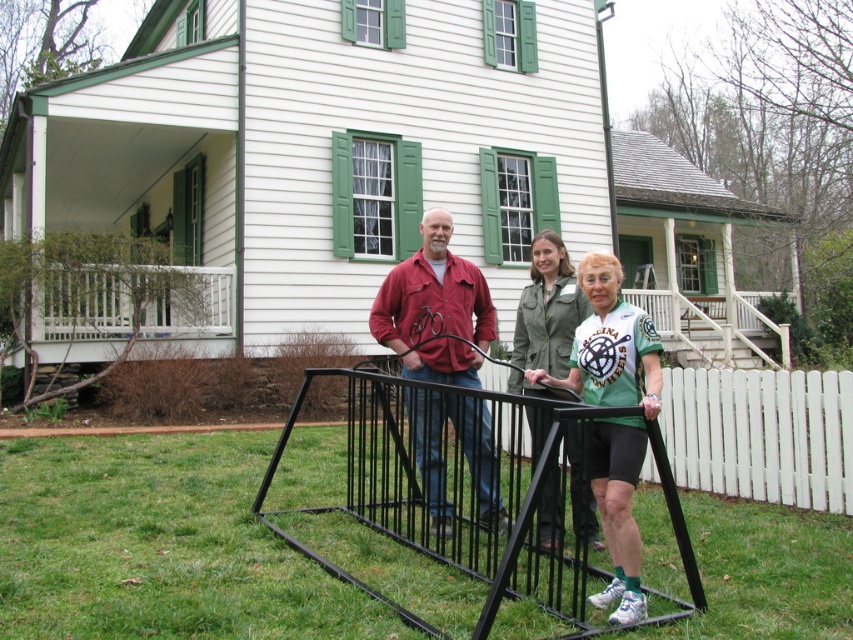
You are standing at the point labeled point (556, 356) and want to walk to the point labeled point (350, 513). According to the scene, which direction should you move relative to your current position?

You should move forward because point (350, 513) is behind point (556, 356), meaning it is in the direction you are facing if you are at point (556, 356).

You are standing at the front of the house and see the matte black bicycle at center and the green fabric shirt at center. Which object is closer to you?

The matte black bicycle at center is closer to you because the green fabric shirt at center is behind it.